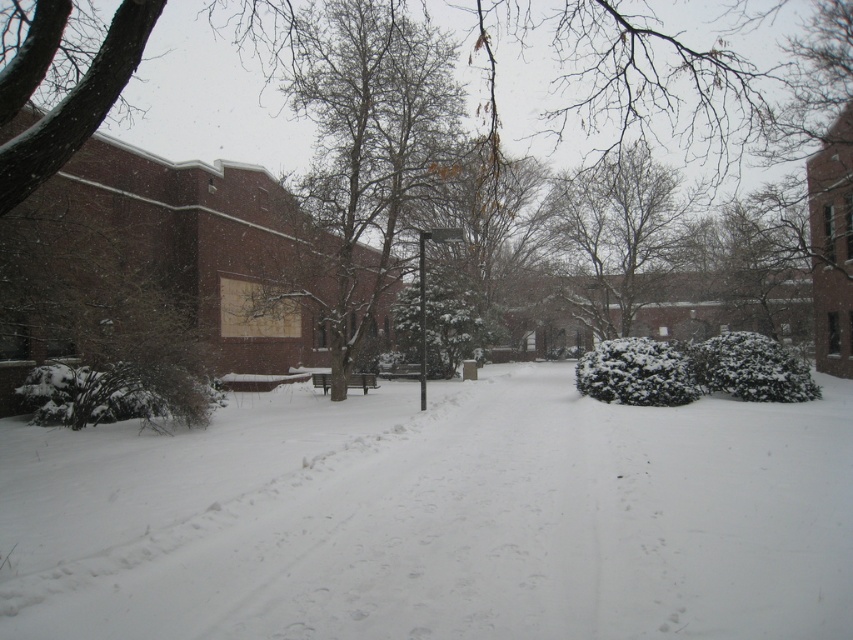
Is white fluffy snow at center closer to the viewer compared to snow-covered tree at center?

Yes, white fluffy snow at center is in front of snow-covered tree at center.

Who is more distant from viewer, (679, 509) or (413, 54)?

The point (413, 54) is behind.

What do you see at coordinates (436, 516) in the screenshot? The height and width of the screenshot is (640, 853). I see `white fluffy snow at center` at bounding box center [436, 516].

I want to click on white fluffy snow at center, so click(x=436, y=516).

Between snow-covered branches at upper center and metallic pole at center, which one appears on the right side from the viewer's perspective?

snow-covered branches at upper center is more to the right.

Is point (624, 328) positioned before point (456, 234)?

No, (624, 328) is behind (456, 234).

At what (x,y) coordinates should I click in order to perform the action: click on snow-covered branches at upper center. Please return your answer as a coordinate pair (x, y). Looking at the image, I should click on (616, 236).

Which of these two, snow-covered tree at center or metallic pole at center, stands taller?

snow-covered tree at center is taller.

Describe the element at coordinates (369, 148) in the screenshot. I see `snow-covered tree at center` at that location.

Is point (386, 248) behind point (422, 292)?

Yes, it is behind point (422, 292).

Where is `snow-covered tree at center`? The width and height of the screenshot is (853, 640). snow-covered tree at center is located at coordinates (369, 148).